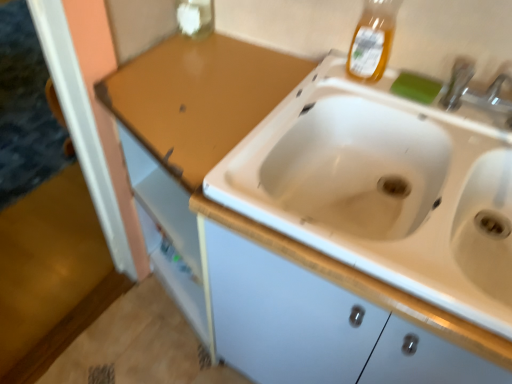
Where is `vacant space situated on the left part of green sponge at upper right`? vacant space situated on the left part of green sponge at upper right is located at coordinates (357, 87).